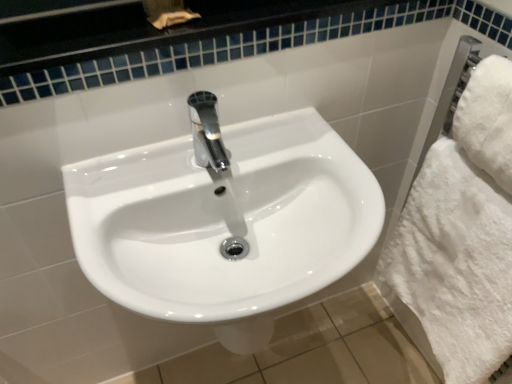
Question: Is white glossy sink at center further to camera compared to white fluffy bath towel at right, the 2th bath towel when ordered from top to bottom?

Choices:
 (A) yes
 (B) no

Answer: (B)

Question: Is white glossy sink at center wider than white fluffy bath towel at right, the 2th bath towel when ordered from top to bottom?

Choices:
 (A) no
 (B) yes

Answer: (B)

Question: Does white glossy sink at center have a larger size compared to white fluffy bath towel at right, which is the first bath towel from bottom to top?

Choices:
 (A) yes
 (B) no

Answer: (A)

Question: Can you confirm if white glossy sink at center is smaller than white fluffy bath towel at right, which is the first bath towel from bottom to top?

Choices:
 (A) no
 (B) yes

Answer: (A)

Question: Does white glossy sink at center have a greater height compared to white fluffy bath towel at right, the 2th bath towel when ordered from top to bottom?

Choices:
 (A) no
 (B) yes

Answer: (A)

Question: From the image's perspective, is white glossy sink at center beneath white fluffy bath towel at right, the 2th bath towel when ordered from top to bottom?

Choices:
 (A) no
 (B) yes

Answer: (A)

Question: Can you confirm if white fluffy bath towel at right, the 2th bath towel when ordered from top to bottom, is taller than white fluffy towel at right, which is the second bath towel in bottom-to-top order?

Choices:
 (A) no
 (B) yes

Answer: (B)

Question: Is white fluffy bath towel at right, which is the first bath towel from bottom to top, wider than white fluffy towel at right, which appears as the first bath towel when viewed from the top?

Choices:
 (A) no
 (B) yes

Answer: (B)

Question: From the image's perspective, is white fluffy bath towel at right, which is the first bath towel from bottom to top, located beneath white fluffy towel at right, which appears as the first bath towel when viewed from the top?

Choices:
 (A) no
 (B) yes

Answer: (B)

Question: Can you confirm if white fluffy bath towel at right, which is the first bath towel from bottom to top, is positioned to the left of white fluffy towel at right, which appears as the first bath towel when viewed from the top?

Choices:
 (A) no
 (B) yes

Answer: (B)

Question: From the image's perspective, is white fluffy bath towel at right, the 2th bath towel when ordered from top to bottom, on white fluffy towel at right, which is the second bath towel in bottom-to-top order?

Choices:
 (A) yes
 (B) no

Answer: (B)

Question: Is white fluffy towel at right, which is the second bath towel in bottom-to-top order, surrounded by white fluffy bath towel at right, which is the first bath towel from bottom to top?

Choices:
 (A) yes
 (B) no

Answer: (B)

Question: Can you confirm if white fluffy towel at right, which appears as the first bath towel when viewed from the top, is shorter than white glossy sink at center?

Choices:
 (A) no
 (B) yes

Answer: (B)